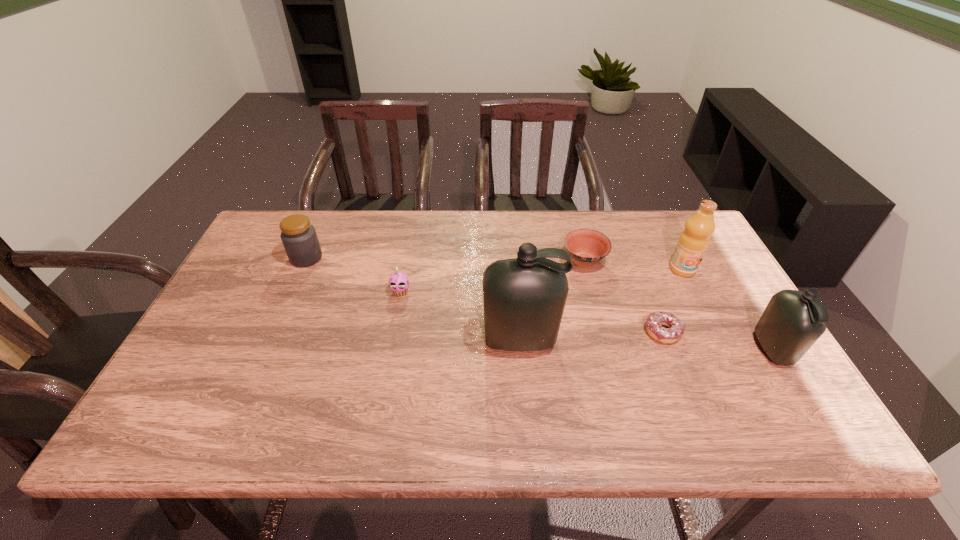
At what (x,y) coordinates should I click in order to perform the action: click on the fifth object from right to left. Please return your answer as a coordinate pair (x, y). Looking at the image, I should click on (524, 298).

The width and height of the screenshot is (960, 540). In order to click on the left bottle in this screenshot , I will do [524, 298].

Where is `the shorter bottle`? The height and width of the screenshot is (540, 960). the shorter bottle is located at coordinates (793, 321).

Identify the location of the right bottle. pos(793,321).

You are a GUI agent. You are given a task and a screenshot of the screen. Output one action in this format:
    pyautogui.click(x=<x>, y=<y>)
    Task: Click on the cupcake
    The width and height of the screenshot is (960, 540).
    Given the screenshot: What is the action you would take?
    pyautogui.click(x=398, y=282)

I want to click on the fifth tallest object, so click(398, 282).

Identify the location of bowl. (586, 247).

This screenshot has width=960, height=540. Find the location of `the second shortest object`. the second shortest object is located at coordinates (586, 247).

Identify the location of jar. (299, 238).

What are the coordinates of `the fourth tallest object` in the screenshot? It's located at (299, 238).